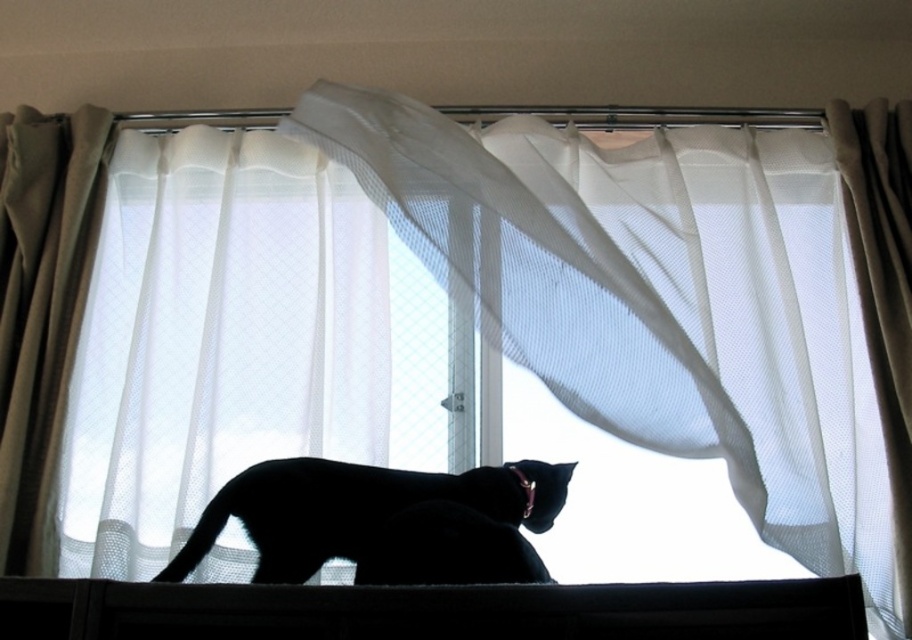
Does point (677, 250) lie in front of point (13, 634)?

That is False.

Which is more to the right, white sheer curtain at center or black plastic window sill at lower center?

From the viewer's perspective, white sheer curtain at center appears more on the right side.

Is point (713, 282) more distant than point (771, 636)?

Yes, it is.

Where is `white sheer curtain at center`? The height and width of the screenshot is (640, 912). white sheer curtain at center is located at coordinates (658, 300).

Between white sheer curtain at center and white sheer curtain at left, which one is positioned higher?

white sheer curtain at center

Who is shorter, white sheer curtain at center or white sheer curtain at left?

Standing shorter between the two is white sheer curtain at left.

Locate an element on the screen. The width and height of the screenshot is (912, 640). white sheer curtain at center is located at coordinates (658, 300).

Find the location of a particular element. The width and height of the screenshot is (912, 640). white sheer curtain at center is located at coordinates (658, 300).

Looking at this image, does white sheer curtain at center appear on the right side of black matte cat at center?

Yes, white sheer curtain at center is to the right of black matte cat at center.

Does white sheer curtain at center have a larger size compared to black matte cat at center?

Indeed, white sheer curtain at center has a larger size compared to black matte cat at center.

Identify the location of white sheer curtain at center. (658, 300).

You are a GUI agent. You are given a task and a screenshot of the screen. Output one action in this format:
    pyautogui.click(x=<x>, y=<y>)
    Task: Click on the white sheer curtain at center
    
    Given the screenshot: What is the action you would take?
    pyautogui.click(x=658, y=300)